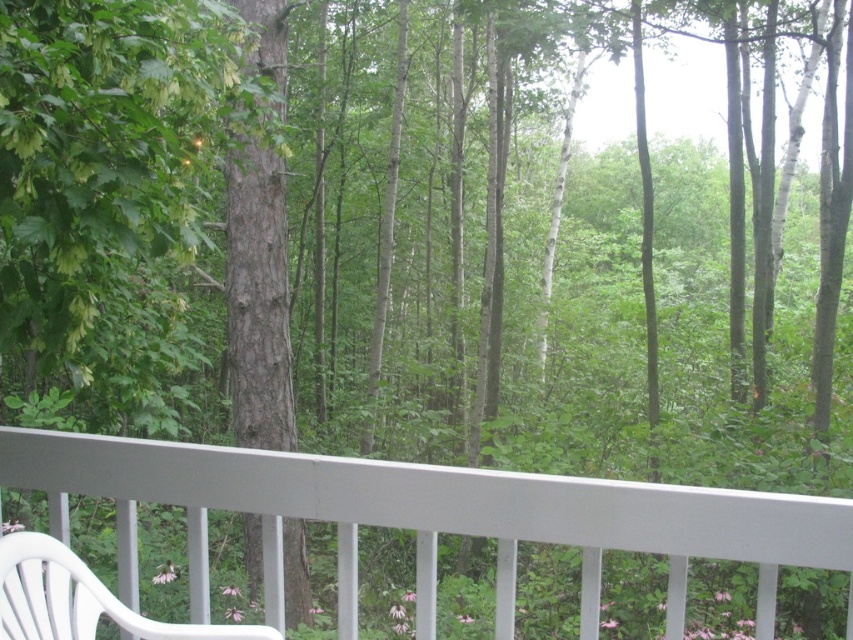
Does white plastic chair at lower left have a smaller size compared to white plastic rocking chair at lower left?

No, white plastic chair at lower left is not smaller than white plastic rocking chair at lower left.

The image size is (853, 640). Describe the element at coordinates (428, 516) in the screenshot. I see `white plastic chair at lower left` at that location.

The width and height of the screenshot is (853, 640). Find the location of `white plastic chair at lower left`. white plastic chair at lower left is located at coordinates (428, 516).

From the picture: Can you confirm if white plastic chair at lower left is thinner than brown rough bark tree at center?

In fact, white plastic chair at lower left might be wider than brown rough bark tree at center.

Which is below, white plastic chair at lower left or brown rough bark tree at center?

white plastic chair at lower left is lower down.

Is point (535, 480) farther from camera compared to point (236, 364)?

No.

At what (x,y) coordinates should I click in order to perform the action: click on white plastic chair at lower left. Please return your answer as a coordinate pair (x, y). The width and height of the screenshot is (853, 640). Looking at the image, I should click on (428, 516).

Does brown rough bark tree at center have a lesser height compared to white plastic rocking chair at lower left?

No, brown rough bark tree at center is not shorter than white plastic rocking chair at lower left.

Who is more forward, (262, 264) or (96, 609)?

Point (96, 609)

You are a GUI agent. You are given a task and a screenshot of the screen. Output one action in this format:
    pyautogui.click(x=<x>, y=<y>)
    Task: Click on the brown rough bark tree at center
    
    Given the screenshot: What is the action you would take?
    pyautogui.click(x=257, y=298)